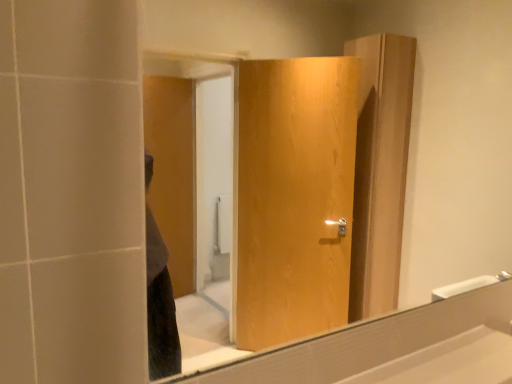
The image size is (512, 384). What do you see at coordinates (412, 111) in the screenshot?
I see `wooden door at center` at bounding box center [412, 111].

Find the location of `wooden door at center`. wooden door at center is located at coordinates [412, 111].

What is the approximate width of wooden door at center?

→ wooden door at center is 2.52 inches wide.

I want to click on wooden door at center, so click(x=412, y=111).